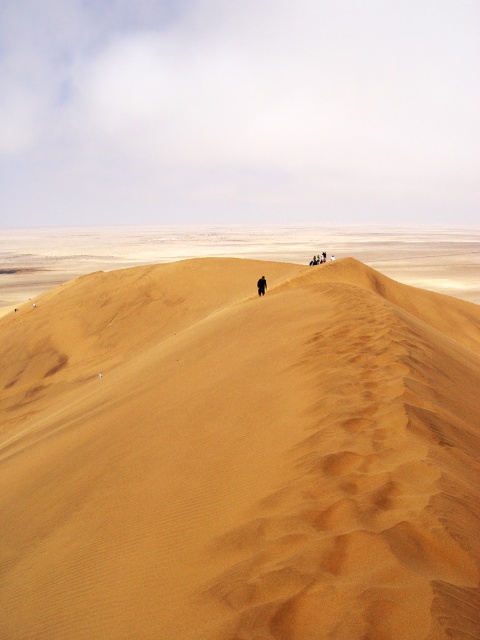
Question: Which of the following is the closest to the observer?

Choices:
 (A) (261, 294)
 (B) (168, 500)

Answer: (B)

Question: Where is sandy yellow dune at center located in relation to brown textured sand dune at upper center in the image?

Choices:
 (A) below
 (B) above

Answer: (A)

Question: Which of the following is the closest to the observer?

Choices:
 (A) (264, 285)
 (B) (268, 570)

Answer: (B)

Question: Does sandy yellow dune at center have a greater width compared to brown textured sand dune at upper center?

Choices:
 (A) no
 (B) yes

Answer: (B)

Question: Is sandy yellow dune at center positioned before brown textured sand dune at upper center?

Choices:
 (A) no
 (B) yes

Answer: (B)